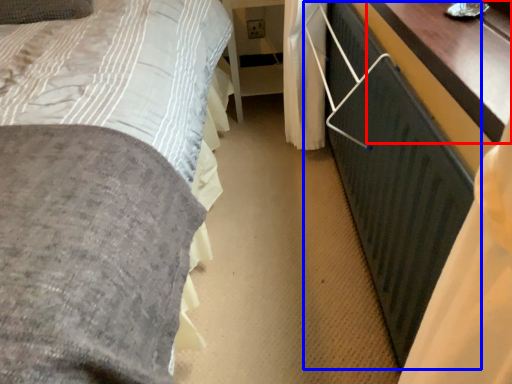
Question: Which point is closer to the camera, table (highlighted by a red box) or balustrade (highlighted by a blue box)?

Choices:
 (A) table
 (B) balustrade

Answer: (B)